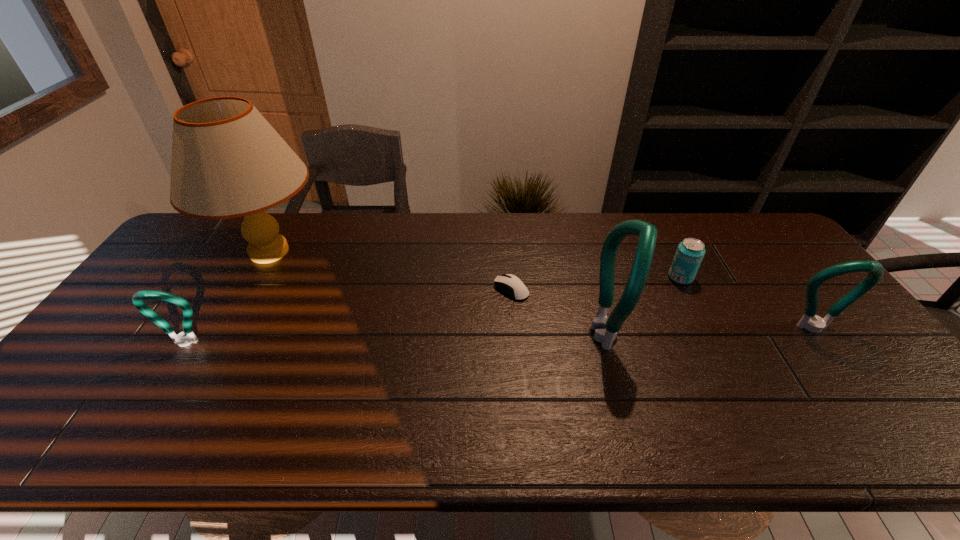
Identify the location of object that is at the far left corner. (227, 161).

This screenshot has height=540, width=960. In order to click on vacant space at the far edge in this screenshot , I will do `click(563, 230)`.

The image size is (960, 540). In the image, there is a desktop. In order to click on vacant space at the near edge in this screenshot , I will do `click(431, 400)`.

Where is `vacant area at the left edge of the desktop`? This screenshot has width=960, height=540. vacant area at the left edge of the desktop is located at coordinates (209, 259).

Where is `free space at the right edge`? The image size is (960, 540). free space at the right edge is located at coordinates (767, 277).

Locate an element on the screen. vacant space at the near left corner of the desktop is located at coordinates (72, 396).

Where is `free space between the lampshade and the second bottle opener from right to left`? The height and width of the screenshot is (540, 960). free space between the lampshade and the second bottle opener from right to left is located at coordinates (439, 293).

The height and width of the screenshot is (540, 960). I want to click on free space between the beer can and the lampshade, so click(475, 265).

The image size is (960, 540). I want to click on free area in between the beer can and the lampshade, so click(475, 265).

Locate an element on the screen. free spot between the third object from right to left and the beer can is located at coordinates (644, 306).